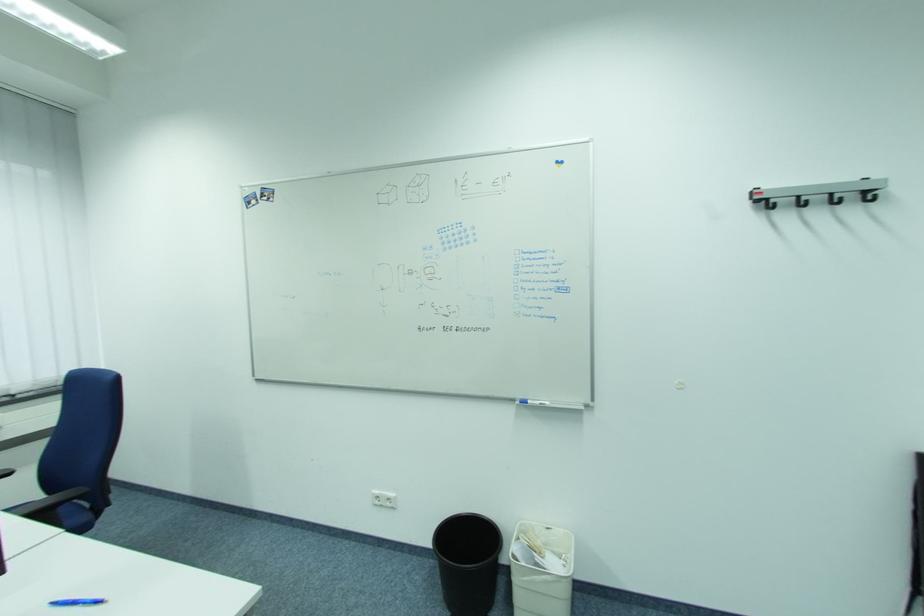
The location [468,562] corresponds to which object?

It refers to a black trash can.